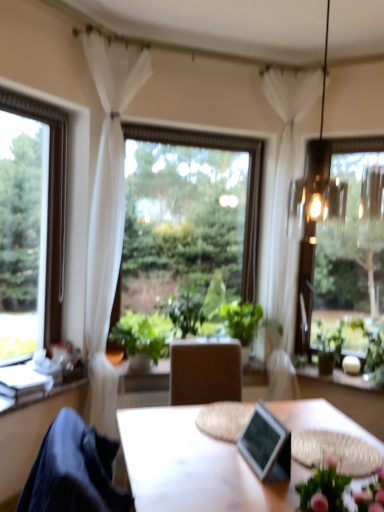
Question: Would you say dark blue fabric at lower left is inside or outside green leafy plant at right, the 1th houseplant from the right?

Choices:
 (A) inside
 (B) outside

Answer: (B)

Question: From the image's perspective, relative to green leafy plant at right, the 1th houseplant from the right, is dark blue fabric at lower left above or below?

Choices:
 (A) above
 (B) below

Answer: (B)

Question: Which is farther from the white sheer curtain at upper center, marked as the second curtain in a left-to-right arrangement?

Choices:
 (A) green matte vase at right
 (B) clear glass window at left, which ranks as the first window in left-to-right order
 (C) white sheer curtain at left, acting as the first curtain starting from the left
 (D) pink fabric floral at lower right
 (E) dark blue fabric at lower left

Answer: (E)

Question: Based on their relative distances, which object is farther from the transparent glass window at center, positioned as the 2th window in left-to-right order?

Choices:
 (A) pink fabric floral at lower right
 (B) transparent glass window at right, the 1th window in the right-to-left sequence
 (C) green matte vase at right
 (D) white sheer curtain at left, marked as the second curtain in a right-to-left arrangement
 (E) green leafy plant at center, positioned as the second houseplant in right-to-left order

Answer: (A)